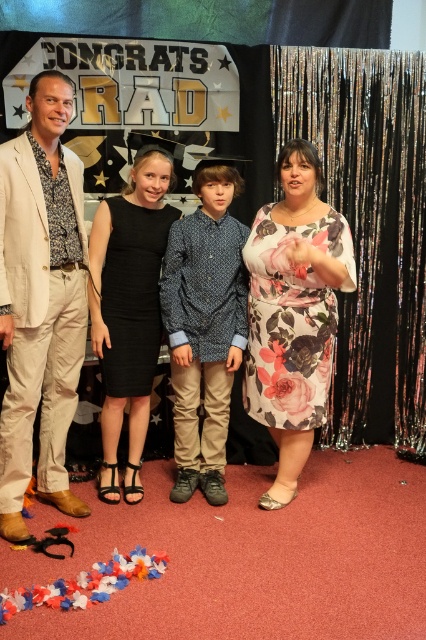
Question: Observing the image, what is the correct spatial positioning of floral dress at center in reference to blue printed shirt at center?

Choices:
 (A) above
 (B) below

Answer: (A)

Question: Among these points, which one is nearest to the camera?

Choices:
 (A) (146, 176)
 (B) (244, 227)
 (C) (43, 449)
 (D) (327, 342)

Answer: (D)

Question: Which point is closer to the camera taking this photo?

Choices:
 (A) (170, 170)
 (B) (48, 364)

Answer: (B)

Question: Can you confirm if beige cotton blazer at left is positioned below floral fabric dress at center?

Choices:
 (A) no
 (B) yes

Answer: (A)

Question: Can you confirm if floral dress at center is positioned to the left of black satin dress at center?

Choices:
 (A) no
 (B) yes

Answer: (A)

Question: Among these points, which one is nearest to the camera?

Choices:
 (A) (294, 202)
 (B) (222, 376)
 (C) (104, 340)

Answer: (A)